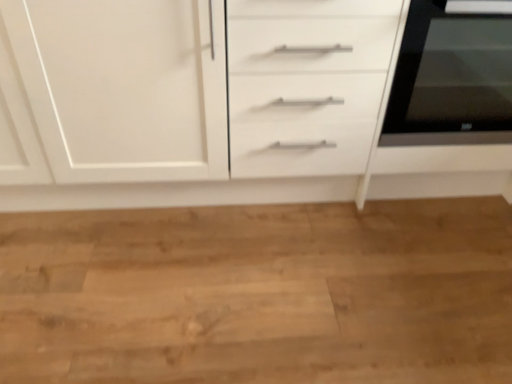
Describe the element at coordinates (451, 79) in the screenshot. This screenshot has width=512, height=384. I see `black glass oven at right` at that location.

Identify the location of black glass oven at right. (451, 79).

Locate an element on the screen. This screenshot has height=384, width=512. white matte cabinet at center is located at coordinates (215, 104).

This screenshot has height=384, width=512. Describe the element at coordinates (215, 104) in the screenshot. I see `white matte cabinet at center` at that location.

Where is `black glass oven at right`? The width and height of the screenshot is (512, 384). black glass oven at right is located at coordinates (451, 79).

Which is more to the right, white matte cabinet at center or black glass oven at right?

Positioned to the right is black glass oven at right.

Is white matte cabinet at center in front of or behind black glass oven at right in the image?

Clearly, white matte cabinet at center is in front of black glass oven at right.

Is point (275, 188) closer or farther from the camera than point (412, 103)?

Point (275, 188).

From the image's perspective, is white matte cabinet at center above or below black glass oven at right?

white matte cabinet at center is situated lower than black glass oven at right in the image.

From a real-world perspective, is white matte cabinet at center positioned above or below black glass oven at right?

white matte cabinet at center is below black glass oven at right.

Can you confirm if white matte cabinet at center is wider than black glass oven at right?

Correct, the width of white matte cabinet at center exceeds that of black glass oven at right.

From their relative heights in the image, would you say white matte cabinet at center is taller or shorter than black glass oven at right?

Clearly, white matte cabinet at center is taller compared to black glass oven at right.

In terms of size, does white matte cabinet at center appear bigger or smaller than black glass oven at right?

white matte cabinet at center is bigger than black glass oven at right.

Is white matte cabinet at center spatially inside black glass oven at right, or outside of it?

white matte cabinet at center is outside black glass oven at right.

Is white matte cabinet at center placed right next to black glass oven at right?

No, white matte cabinet at center is not touching black glass oven at right.

Is white matte cabinet at center oriented away from black glass oven at right?

Correct, white matte cabinet at center is looking away from black glass oven at right.

What's the angular difference between white matte cabinet at center and black glass oven at right's facing directions?

0.291 degrees separate the facing orientations of white matte cabinet at center and black glass oven at right.

Image resolution: width=512 pixels, height=384 pixels. Identify the location of the chest of drawers that appears below the black glass oven at right (from the image's perspective). (215, 104).

Does black glass oven at right appear on the left side of white matte cabinet at center?

In fact, black glass oven at right is to the right of white matte cabinet at center.

Is the position of black glass oven at right more distant than that of white matte cabinet at center?

That is True.

Is point (436, 134) positioned after point (239, 126)?

Yes.

From the image's perspective, is black glass oven at right over white matte cabinet at center?

Correct, black glass oven at right appears higher than white matte cabinet at center in the image.

From a real-world perspective, which object stands above the other?

black glass oven at right.

Can you confirm if black glass oven at right is thinner than white matte cabinet at center?

Correct, the width of black glass oven at right is less than that of white matte cabinet at center.

Consider the image. Considering the sizes of objects black glass oven at right and white matte cabinet at center in the image provided, who is shorter, black glass oven at right or white matte cabinet at center?

black glass oven at right.

Does black glass oven at right have a smaller size compared to white matte cabinet at center?

Indeed, black glass oven at right has a smaller size compared to white matte cabinet at center.

In the scene shown: Is white matte cabinet at center surrounded by black glass oven at right?

No, white matte cabinet at center is not inside black glass oven at right.

Are black glass oven at right and white matte cabinet at center beside each other?

No, black glass oven at right is not making contact with white matte cabinet at center.

Is black glass oven at right oriented away from white matte cabinet at center?

Yes, black glass oven at right is positioned with its back facing white matte cabinet at center.

Where is `home appliance on the right of the white matte cabinet at center`? The image size is (512, 384). home appliance on the right of the white matte cabinet at center is located at coordinates (451, 79).

The height and width of the screenshot is (384, 512). What are the coordinates of `chest of drawers that appears on the left of black glass oven at right` in the screenshot? It's located at (215, 104).

The height and width of the screenshot is (384, 512). What are the coordinates of `chest of drawers below the black glass oven at right (from a real-world perspective)` in the screenshot? It's located at (215, 104).